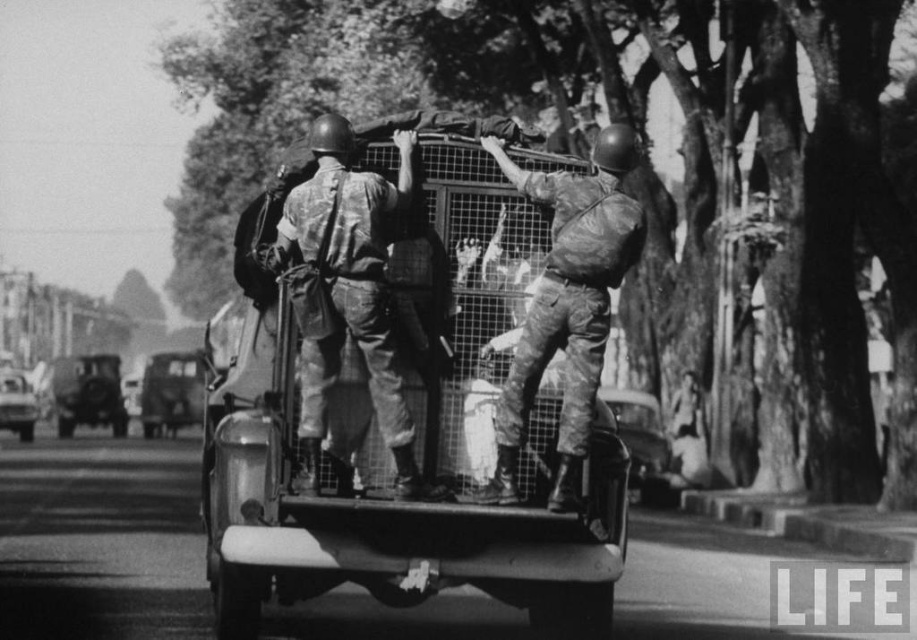
You are a photographer trying to capture a clear photo of both the camouflage fabric uniform at center and the camouflage fabric soldier at center. Which one is blocking the view of the other?

The camouflage fabric uniform at center is blocking the view of the camouflage fabric soldier at center because it is in front of it.

Please provide the 2D coordinates of the camouflage fabric uniform at center in the image. The coordinates should be in the format of a point with two decimal places, such as 0.123,0.456.

The camouflage fabric uniform at center is located at point (346, 291).